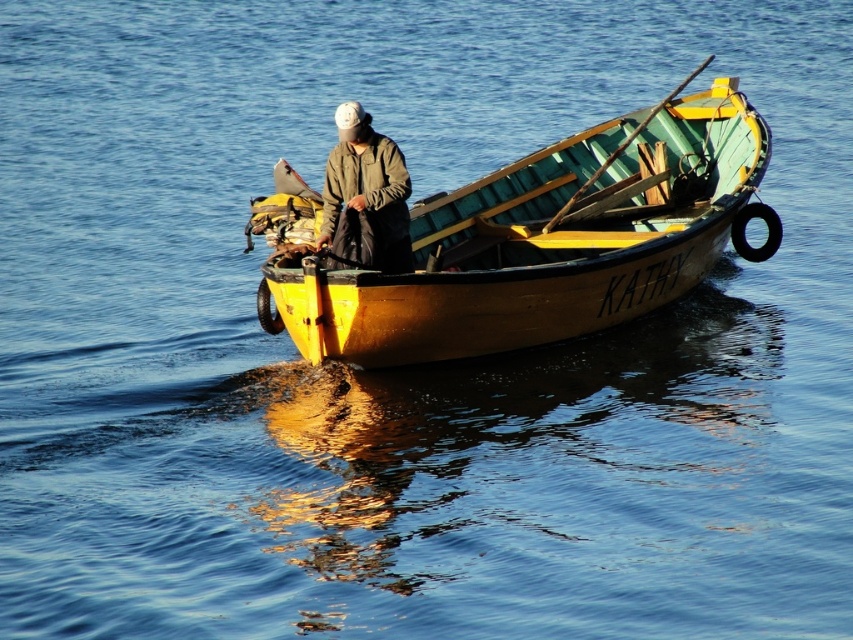
Question: Can you confirm if wooden boat at center is positioned to the left of green matte jacket at center?

Choices:
 (A) no
 (B) yes

Answer: (A)

Question: Which object is farther from the camera taking this photo?

Choices:
 (A) green matte jacket at center
 (B) wooden boat at center

Answer: (A)

Question: Is wooden boat at center wider than green matte jacket at center?

Choices:
 (A) yes
 (B) no

Answer: (A)

Question: Does wooden boat at center have a greater width compared to green matte jacket at center?

Choices:
 (A) yes
 (B) no

Answer: (A)

Question: Which point is closer to the camera?

Choices:
 (A) wooden boat at center
 (B) green matte jacket at center

Answer: (A)

Question: Which point is farther to the camera?

Choices:
 (A) (329, 186)
 (B) (691, 157)

Answer: (B)